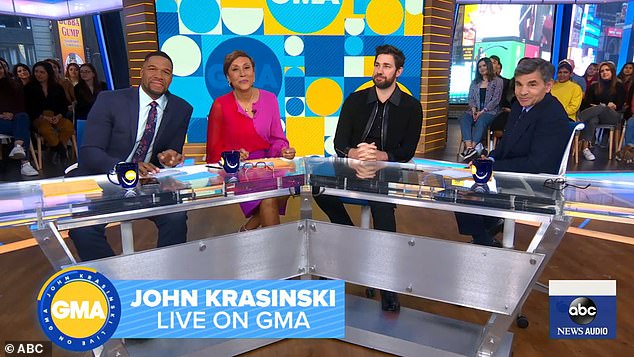
This screenshot has height=357, width=634. In order to click on wood wall in this screenshot , I will do `click(435, 31)`.